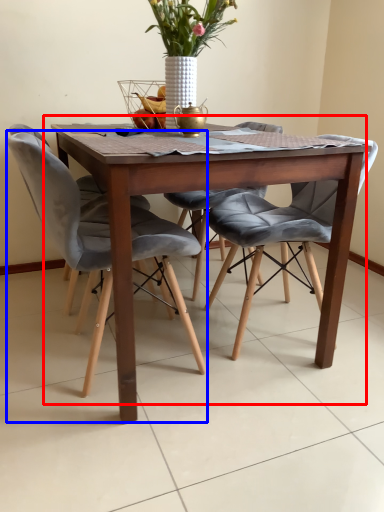
Question: Which of the following is the closest to the observer, kitchen & dining room table (highlighted by a red box) or chair (highlighted by a blue box)?

Choices:
 (A) kitchen & dining room table
 (B) chair

Answer: (A)